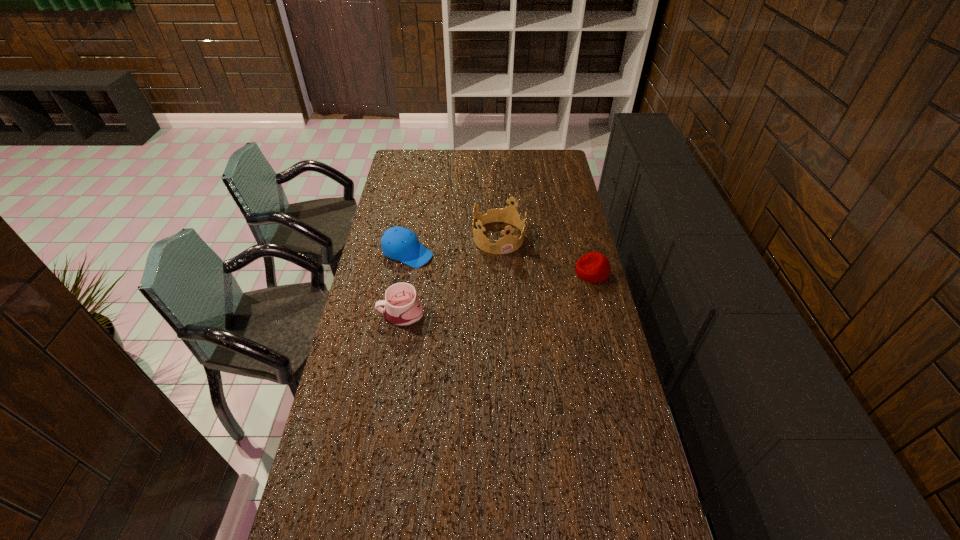
What are the coordinates of `free space located 0.300m on the front-facing side of the third object from left to right` in the screenshot? It's located at (536, 305).

Where is `blank space located 0.260m on the front-facing side of the third object from left to right`? blank space located 0.260m on the front-facing side of the third object from left to right is located at coordinates (531, 298).

Image resolution: width=960 pixels, height=540 pixels. What are the coordinates of `free region located 0.180m on the front-facing side of the cap` in the screenshot? It's located at (466, 276).

The height and width of the screenshot is (540, 960). In order to click on free space located 0.110m on the front-facing side of the cap in this screenshot , I will do `click(451, 270)`.

Where is `vacant space positioned 0.390m on the front-facing side of the cap`? vacant space positioned 0.390m on the front-facing side of the cap is located at coordinates (514, 296).

What are the coordinates of `mug that is at the left edge` in the screenshot? It's located at (402, 308).

You are a GUI agent. You are given a task and a screenshot of the screen. Output one action in this format:
    pyautogui.click(x=<x>, y=<y>)
    Task: Click on the cap at the left edge
    The image size is (960, 540).
    Given the screenshot: What is the action you would take?
    pyautogui.click(x=398, y=243)

Image resolution: width=960 pixels, height=540 pixels. In order to click on object situated at the right edge in this screenshot , I will do `click(593, 267)`.

Locate an element on the screen. The image size is (960, 540). vacant space at the far edge of the desktop is located at coordinates (501, 171).

Identify the location of vacant space at the near edge of the desktop. This screenshot has width=960, height=540. point(389,512).